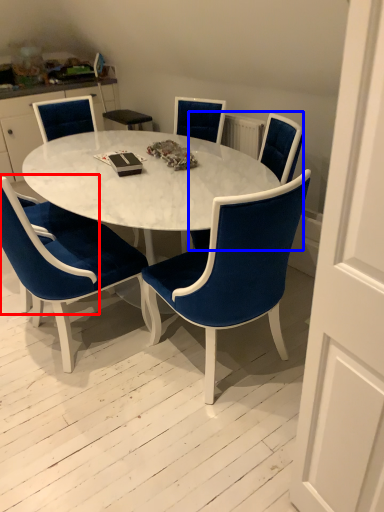
Question: Which object appears closest to the camera in this image, armchair (highlighted by a red box) or chair (highlighted by a blue box)?

Choices:
 (A) armchair
 (B) chair

Answer: (B)